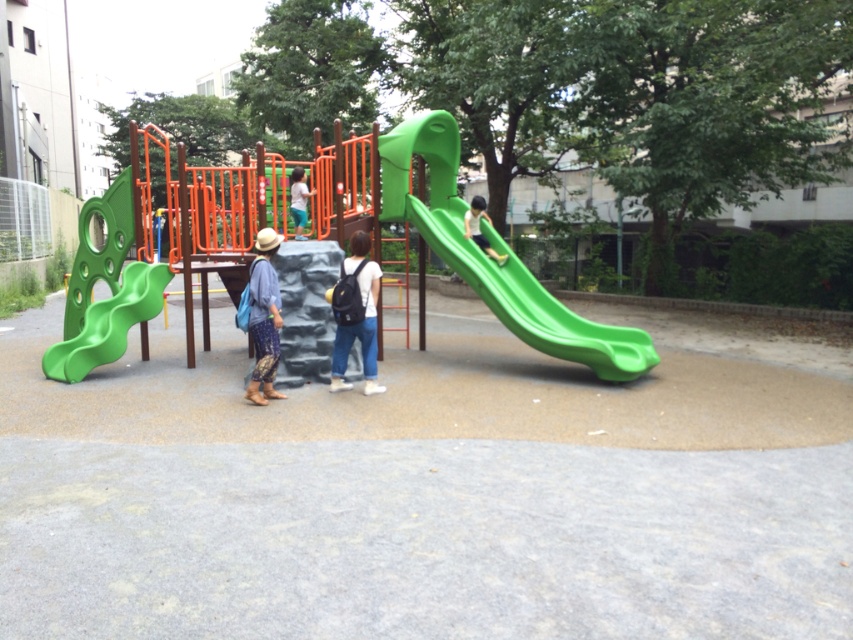
You are a parent at the playground and want to put your child into the green matte slide at right. The black fabric backpack at center is in the way. Can you lift the backpack to move it aside?

The black fabric backpack at center has a smaller size compared to green matte slide at right, so it is possible to lift it and move it aside to access the slide.

You are a parent trying to decide whether to let your child play on the green plastic slide at center while carrying the black fabric backpack at center. Can the backpack fit on the slide?

The green plastic slide at center has a larger size compared to black fabric backpack at center, so the backpack can fit on the slide.